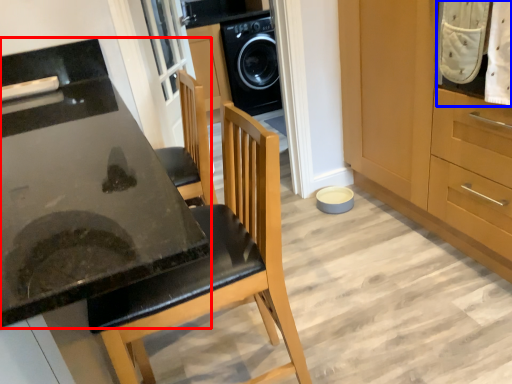
Question: Which of the following is the farthest to the observer, countertop (highlighted by a red box) or laundry (highlighted by a blue box)?

Choices:
 (A) countertop
 (B) laundry

Answer: (B)